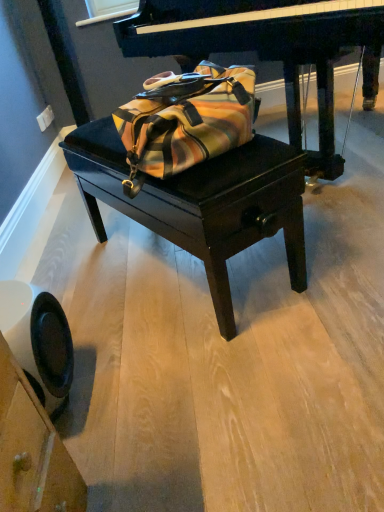
Question: Is velvet black table at center wider or thinner than polished dark wood piano at center?

Choices:
 (A) thin
 (B) wide

Answer: (A)

Question: Considering the positions of velvet black table at center and polished dark wood piano at center in the image, is velvet black table at center bigger or smaller than polished dark wood piano at center?

Choices:
 (A) small
 (B) big

Answer: (A)

Question: Which object is positioned farthest from the polished dark wood piano at center?

Choices:
 (A) velvet black table at center
 (B) black plastic swivel chair at lower left

Answer: (B)

Question: Which object is the farthest from the velvet black table at center?

Choices:
 (A) black plastic swivel chair at lower left
 (B) polished dark wood piano at center

Answer: (B)